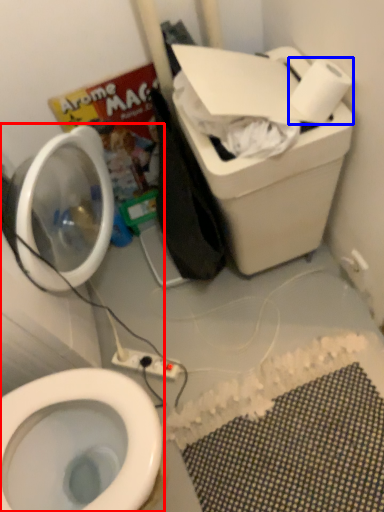
Question: Which object is further to the camera taking this photo, toiletries (highlighted by a red box) or toilet paper (highlighted by a blue box)?

Choices:
 (A) toiletries
 (B) toilet paper

Answer: (B)